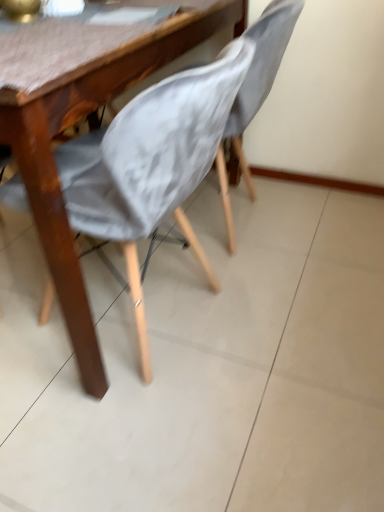
Question: Relative to matte gray fabric chair at center, which ranks as the 1th chair in left-to-right order, is gray fabric chair at center, the 1th chair when ordered from right to left, in front or behind?

Choices:
 (A) behind
 (B) front

Answer: (A)

Question: From the image's perspective, relative to matte gray fabric chair at center, the 2th chair when ordered from right to left, is gray fabric chair at center, the 1th chair when ordered from right to left, above or below?

Choices:
 (A) below
 (B) above

Answer: (B)

Question: Is gray fabric chair at center, the 1th chair when ordered from right to left, spatially inside matte gray fabric chair at center, which ranks as the 1th chair in left-to-right order, or outside of it?

Choices:
 (A) outside
 (B) inside

Answer: (B)

Question: Which is correct: matte gray fabric chair at center, which ranks as the 1th chair in left-to-right order, is inside gray fabric chair at center, arranged as the second chair when viewed from the left, or outside of it?

Choices:
 (A) inside
 (B) outside

Answer: (B)

Question: Considering the positions of point (213, 91) and point (236, 154), is point (213, 91) closer or farther from the camera than point (236, 154)?

Choices:
 (A) closer
 (B) farther

Answer: (A)

Question: Considering the relative positions of matte gray fabric chair at center, the 2th chair when ordered from right to left, and gray fabric chair at center, the 1th chair when ordered from right to left, in the image provided, is matte gray fabric chair at center, the 2th chair when ordered from right to left, to the left or to the right of gray fabric chair at center, the 1th chair when ordered from right to left,?

Choices:
 (A) left
 (B) right

Answer: (A)

Question: Is matte gray fabric chair at center, the 2th chair when ordered from right to left, bigger or smaller than gray fabric chair at center, the 1th chair when ordered from right to left?

Choices:
 (A) big
 (B) small

Answer: (A)